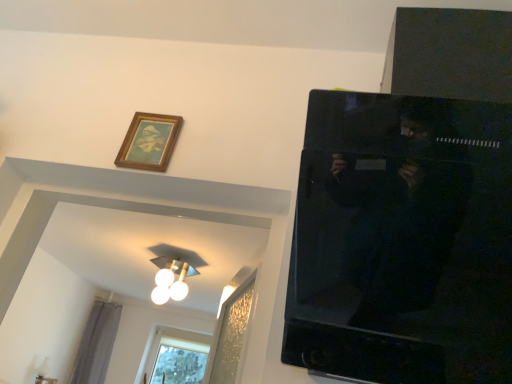
Question: From a real-world perspective, is clear glass window at lower left physically below wooden picture frame at upper left?

Choices:
 (A) yes
 (B) no

Answer: (A)

Question: Is clear glass window at lower left to the left of wooden picture frame at upper left from the viewer's perspective?

Choices:
 (A) no
 (B) yes

Answer: (B)

Question: Is clear glass window at lower left aimed at wooden picture frame at upper left?

Choices:
 (A) yes
 (B) no

Answer: (A)

Question: Is clear glass window at lower left to the right of wooden picture frame at upper left from the viewer's perspective?

Choices:
 (A) no
 (B) yes

Answer: (A)

Question: Can you see clear glass window at lower left touching wooden picture frame at upper left?

Choices:
 (A) yes
 (B) no

Answer: (B)

Question: Is clear glass window at lower left far from wooden picture frame at upper left?

Choices:
 (A) no
 (B) yes

Answer: (B)

Question: Would you say white glossy light fixture at upper center is a long distance from gray fabric curtain at lower left?

Choices:
 (A) yes
 (B) no

Answer: (A)

Question: Is white glossy light fixture at upper center smaller than gray fabric curtain at lower left?

Choices:
 (A) no
 (B) yes

Answer: (B)

Question: Does white glossy light fixture at upper center turn towards gray fabric curtain at lower left?

Choices:
 (A) yes
 (B) no

Answer: (B)

Question: Is white glossy light fixture at upper center bigger than gray fabric curtain at lower left?

Choices:
 (A) yes
 (B) no

Answer: (B)

Question: Does white glossy light fixture at upper center have a lesser width compared to gray fabric curtain at lower left?

Choices:
 (A) no
 (B) yes

Answer: (A)

Question: Is white glossy light fixture at upper center facing away from gray fabric curtain at lower left?

Choices:
 (A) yes
 (B) no

Answer: (B)

Question: From a real-world perspective, is clear glass window at lower left beneath white glossy light fixture at upper center?

Choices:
 (A) no
 (B) yes

Answer: (B)